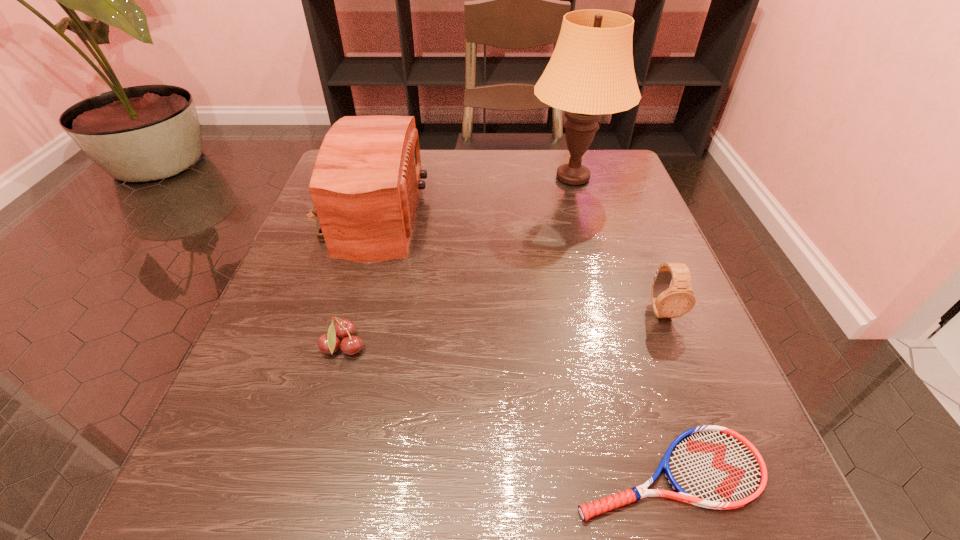
Find the location of a particular element. The width and height of the screenshot is (960, 540). unoccupied area between the tallest object and the radio receiver is located at coordinates click(x=469, y=197).

The width and height of the screenshot is (960, 540). I want to click on free spot between the cherry and the third farthest object, so click(502, 329).

Identify the location of free space between the nearest object and the tallest object. The height and width of the screenshot is (540, 960). (620, 326).

The height and width of the screenshot is (540, 960). Identify the location of unoccupied area between the tallest object and the shortest object. (620, 326).

In order to click on vacant point located between the lampshade and the fourth shortest object in this screenshot , I will do `click(469, 197)`.

Identify the location of free point between the second nearest object and the lampshade. Image resolution: width=960 pixels, height=540 pixels. (458, 263).

Where is `unoccupied position between the radio receiver and the lampshade`? unoccupied position between the radio receiver and the lampshade is located at coordinates (469, 197).

Where is `vacant space that's between the radio receiver and the tallest object`? vacant space that's between the radio receiver and the tallest object is located at coordinates (469, 197).

Where is `vacant region between the tennis racket and the fourth shortest object`? The image size is (960, 540). vacant region between the tennis racket and the fourth shortest object is located at coordinates (517, 344).

Locate an element on the screen. The image size is (960, 540). empty space that is in between the fourth tallest object and the second tallest object is located at coordinates (355, 282).